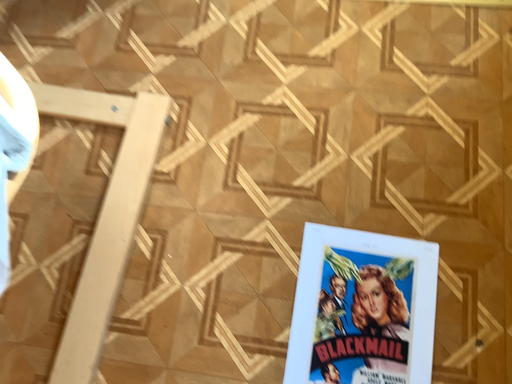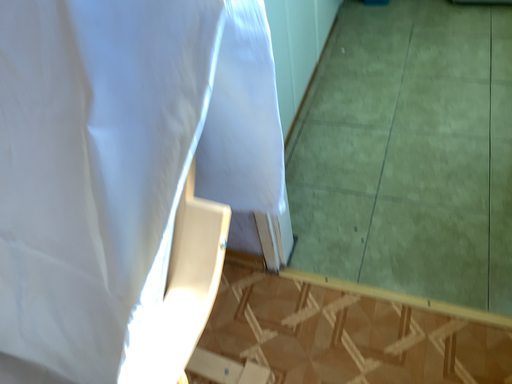
Question: How did the camera likely rotate when shooting the video?

Choices:
 (A) rotated left
 (B) rotated right

Answer: (A)